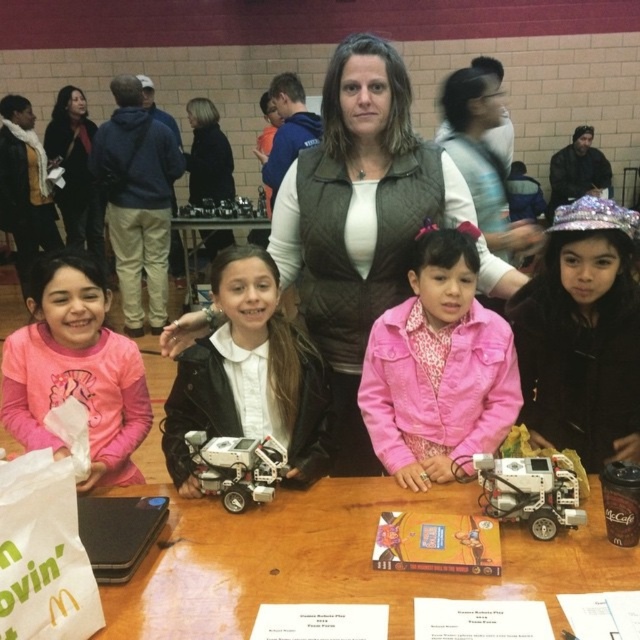
You are a participant in the event and want to place a small sticker on the taller object between the sparkly silver tiara at upper right and the white matte robot at center. Which object should you choose?

The sparkly silver tiara at upper right is taller than the white matte robot at center, so you should place the sticker on the sparkly silver tiara at upper right.

You are standing at the entrance of the gymnasium and see the point marked at coordinates (438, 369). What object or person is located at that point?

The pink corduroy jacket at center is represented by point (438, 369).

You are a photographer standing at the camera position. You want to take a closeup photo of the pink corduroy jacket at center. Is the jacket within the recommended 5 feet distance for closeup shots?

The distance between the pink corduroy jacket at center and the camera is 5.01 feet, which is just beyond the recommended 5 feet for closeup shots. Therefore, the jacket is slightly out of range for an optimal closeup.